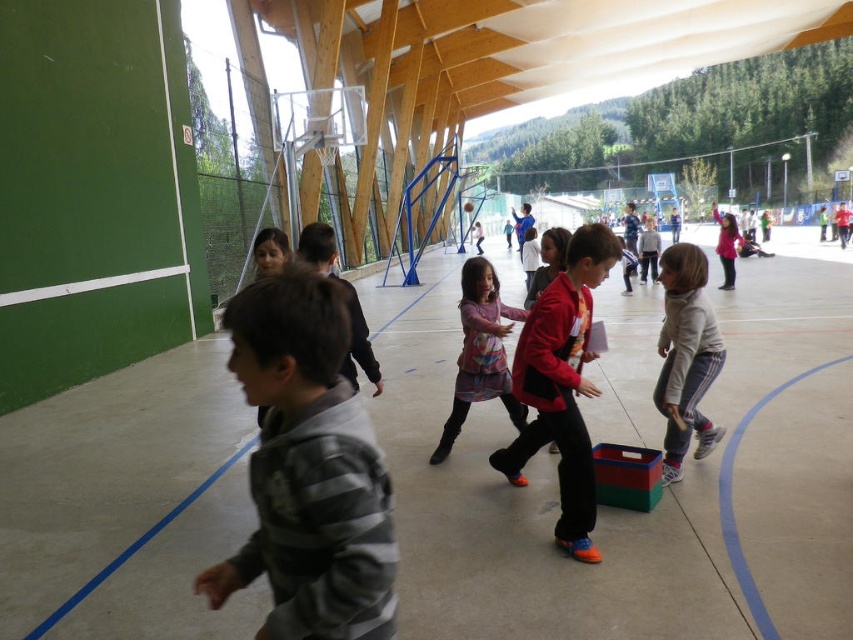
You are a child participating in a game in the gymnasium and you see the red matte jacket at center and the white fleece jacket at center. Which jacket is positioned to the left?

The red matte jacket at center is positioned to the left of the white fleece jacket at center.

You are a photographer trying to capture the red matte jacket at center in the gymnasium. The gym has a coordinate system where the bottom left corner is the origin. The photographer is currently at position point 0.5,0.5. Can you determine if the jacket is to the northeast of your current position?

The red matte jacket at center is located at point (561, 385). Since the photographer is at (426, 320), the jacket is northeast of the photographer because both the x and y coordinates are higher than the photographer.

You are a photographer standing at the entrance of the gymnasium. You need to take a photo that includes both the multicolored fabric dress at center and the matte pink sweater at center. Given that your camera has a maximum focus range of 10 meters, will you be able to capture both subjects in focus?

The multicolored fabric dress at center and the matte pink sweater at center are 10.56 meters apart from each other. Since the distance between them exceeds the camera maximum focus range of 10 meters, the photographer will not be able to capture both subjects in focus.